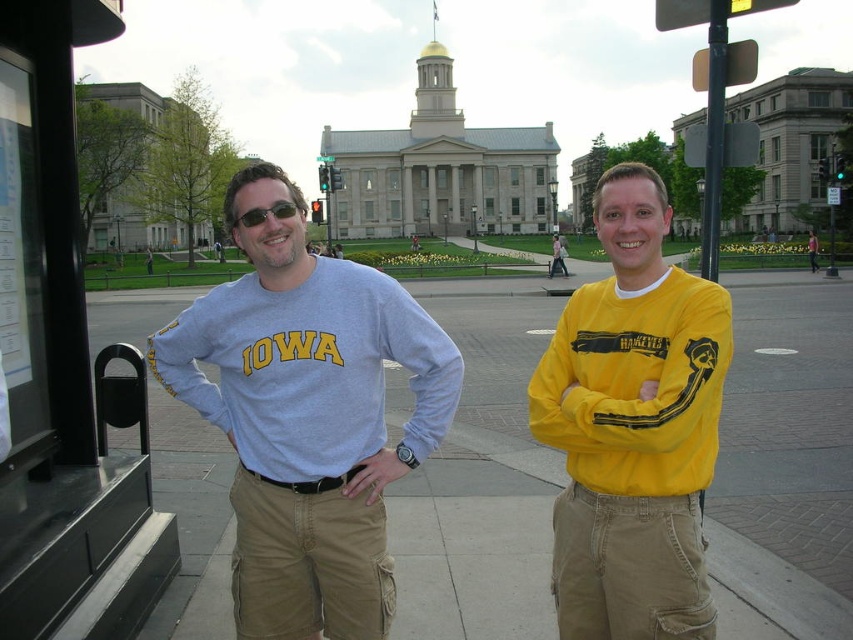
Question: Is light blue cotton shirt at center positioned before matte black sunglasses at center?

Choices:
 (A) no
 (B) yes

Answer: (B)

Question: Estimate the real-world distances between objects in this image. Which object is farther from the light gray concrete sidewalk at center?

Choices:
 (A) matte gray shirt at center
 (B) matte black sunglasses at center
 (C) yellow matte long-sleeve shirt at center
 (D) metallic bus stop at left

Answer: (A)

Question: Is light gray concrete sidewalk at center to the left of yellow matte long-sleeve shirt at center from the viewer's perspective?

Choices:
 (A) yes
 (B) no

Answer: (A)

Question: Which point is farther from the camera taking this photo?

Choices:
 (A) (70, 76)
 (B) (834, 460)

Answer: (B)

Question: Which of the following is the farthest from the observer?

Choices:
 (A) light blue cotton shirt at center
 (B) metallic bus stop at left
 (C) matte gray shirt at center
 (D) matte black sunglasses at center

Answer: (C)

Question: Is light gray concrete sidewalk at center behind metallic bus stop at left?

Choices:
 (A) no
 (B) yes

Answer: (B)